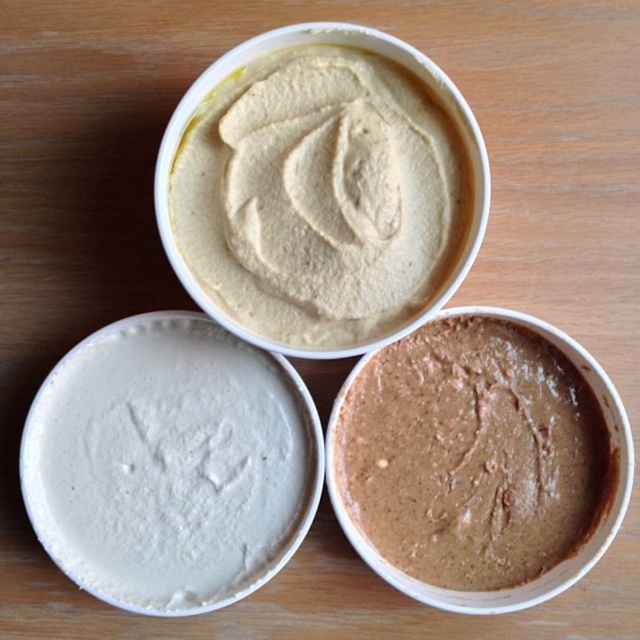
Between white matte frosting at center and smooth beige pudding at upper center, which one is positioned higher?

Positioned higher is smooth beige pudding at upper center.

Is point (102, 499) more distant than point (228, 65)?

Yes, point (102, 499) is farther from viewer.

What are the coordinates of `white matte frosting at center` in the screenshot? It's located at coord(166,465).

Between point (80, 372) and point (385, 528), which one is positioned in front?

Point (80, 372) is more forward.

Is point (168, 320) less distant than point (376, 449)?

Yes.

The width and height of the screenshot is (640, 640). Find the location of `white matte frosting at center`. white matte frosting at center is located at coordinates (166, 465).

Does brown matte hummus at bottom right have a larger size compared to smooth beige pudding at upper center?

Actually, brown matte hummus at bottom right might be smaller than smooth beige pudding at upper center.

Does brown matte hummus at bottom right appear on the left side of smooth beige pudding at upper center?

No, brown matte hummus at bottom right is not to the left of smooth beige pudding at upper center.

Find the location of `brown matte hummus at bottom right`. brown matte hummus at bottom right is located at coordinates (472, 454).